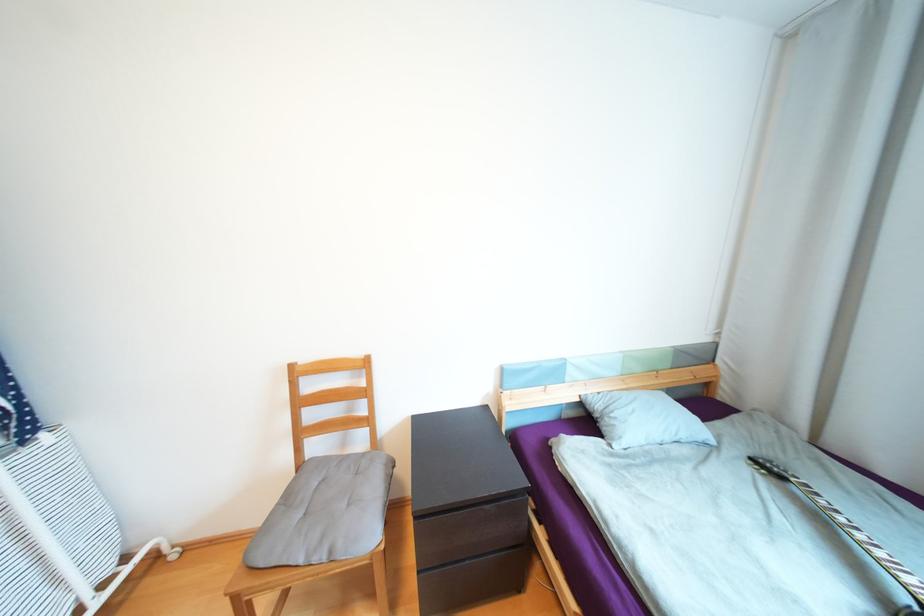
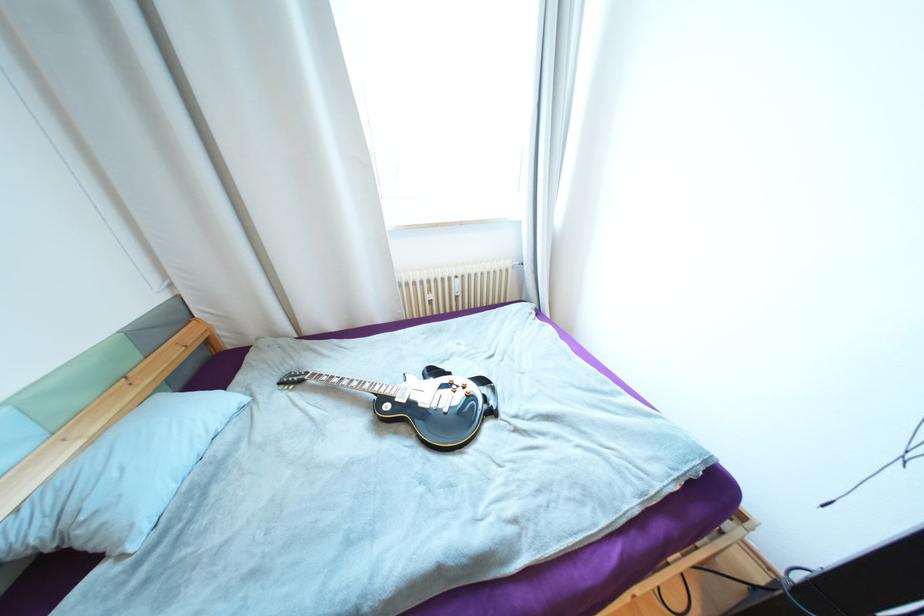
First-person continuous shooting, in which direction is the camera rotating?

The camera rotated toward right-down.